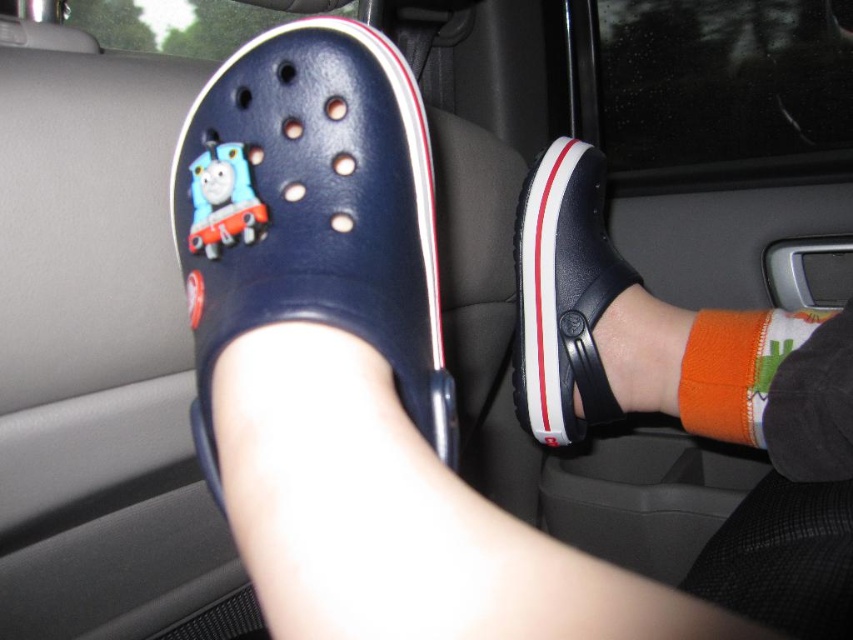
Question: Does navy rubber croc at center have a greater width compared to matte black croc at center?

Choices:
 (A) yes
 (B) no

Answer: (B)

Question: Which point appears closest to the camera in this image?

Choices:
 (A) (206, 195)
 (B) (746, 429)
 (C) (305, 76)
 (D) (614, 291)

Answer: (A)

Question: Can you confirm if navy rubber croc at center is bigger than orange knitted sock at lower right?

Choices:
 (A) no
 (B) yes

Answer: (B)

Question: Does navy rubber croc at center have a smaller size compared to matte black croc at center?

Choices:
 (A) yes
 (B) no

Answer: (A)

Question: Which of the following is the farthest from the observer?

Choices:
 (A) blue matte thomas the tank engine at left
 (B) black rubber sandal at center
 (C) matte black croc at center

Answer: (B)

Question: Which object is positioned farthest from the matte black croc at center?

Choices:
 (A) black rubber sandal at center
 (B) blue matte thomas the tank engine at left

Answer: (B)